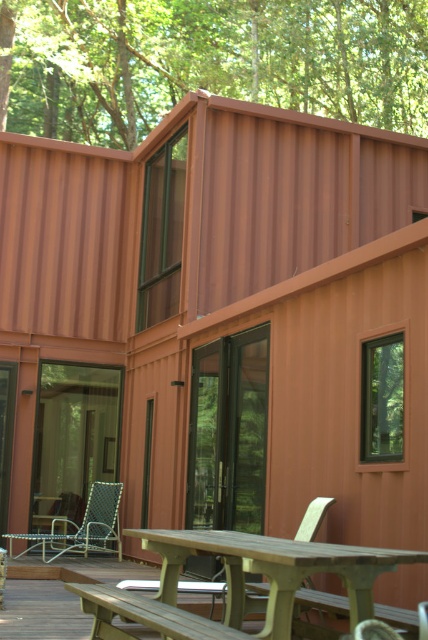
You are sitting on the wooden bench at lower center and want to place a book on the light brown wooden table at center. Will you need to stand up to do this?

The light brown wooden table at center is taller than the wooden bench at lower center, so you will need to stand up to place the book on the table.

You are planning to set up a small garden between the light brown wooden table at center and the wooden bench at lower center. Which object should you place the garden closer to if you want it to be closer to the bench?

The garden should be placed closer to the wooden bench at lower center because the light brown wooden table at center is positioned on the right side of the wooden bench at lower center, meaning the bench is to the left of the table. Therefore, placing the garden near the bench would be closer to it.